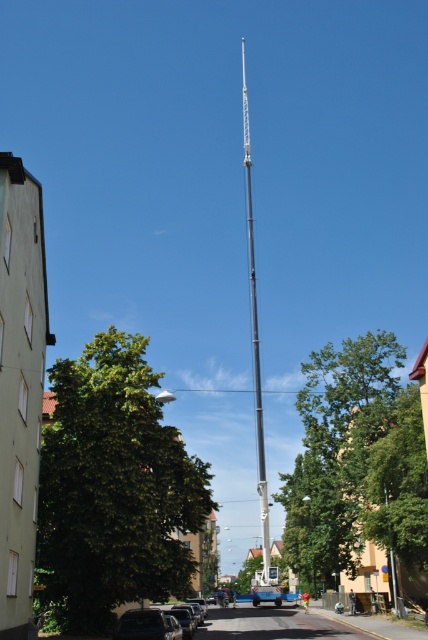
From the picture: You are standing on the sidewalk and see the green concrete building at left and the metallic gray mast at center. Which object is closer to your right side?

The metallic gray mast at center is closer to your right side because the green concrete building at left is positioned on the left side of it.

You are standing at the point marked as point (255, 339) in the urban street scene. What object is located exactly at your current position?

The metallic gray mast at center is located exactly at point (255, 339).

You are a city planner assessing the urban space. You need to determine if the shiny silver car at lower left can be parked closer to the metallic gray mast at center without blocking the crane. Based on their sizes, is this feasible?

The metallic gray mast at center is larger in size than the shiny silver car at lower left. Therefore, the shiny silver car at lower left can be parked closer to the metallic gray mast at center without blocking the crane, as the mast is bigger and can accommodate the car near it.